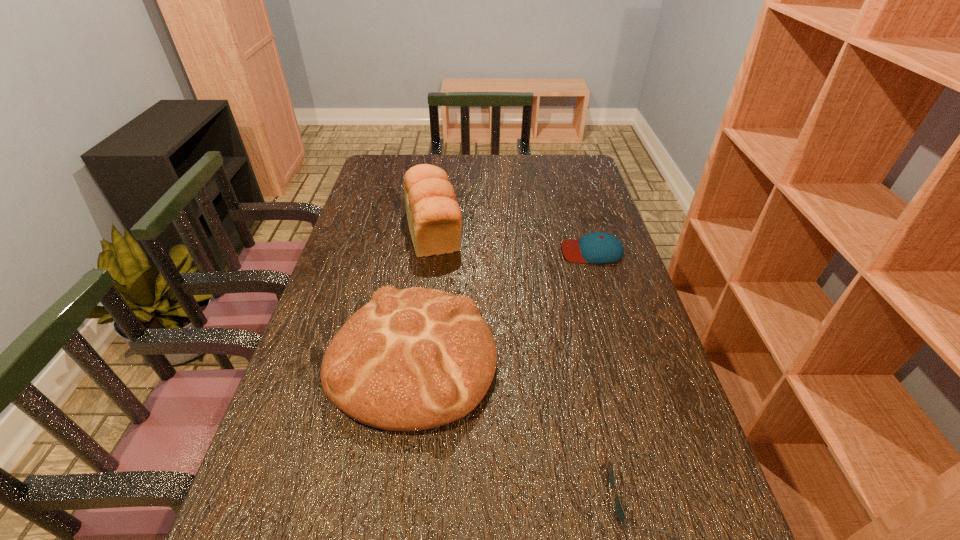
Where is `object that is the second closest one to the shortest object`? This screenshot has height=540, width=960. object that is the second closest one to the shortest object is located at coordinates (598, 247).

You are a GUI agent. You are given a task and a screenshot of the screen. Output one action in this format:
    pyautogui.click(x=<x>, y=<y>)
    Task: Click on the free space that satisfies the following two spatial constraints: 1. on the back side of the nearer bread; 2. on the left side of the farther bread
    
    Given the screenshot: What is the action you would take?
    [x=430, y=230]

At what (x,y) coordinates should I click in order to perform the action: click on vacant space that satisfies the following two spatial constraints: 1. with the bill of the second shortest object facing forward; 2. on the front side of the second tallest object. Please return your answer as a coordinate pair (x, y). The image size is (960, 540). Looking at the image, I should click on (624, 358).

In order to click on free space in the image that satisfies the following two spatial constraints: 1. on the back side of the farther bread; 2. on the right side of the second tallest object in this screenshot , I will do `click(430, 230)`.